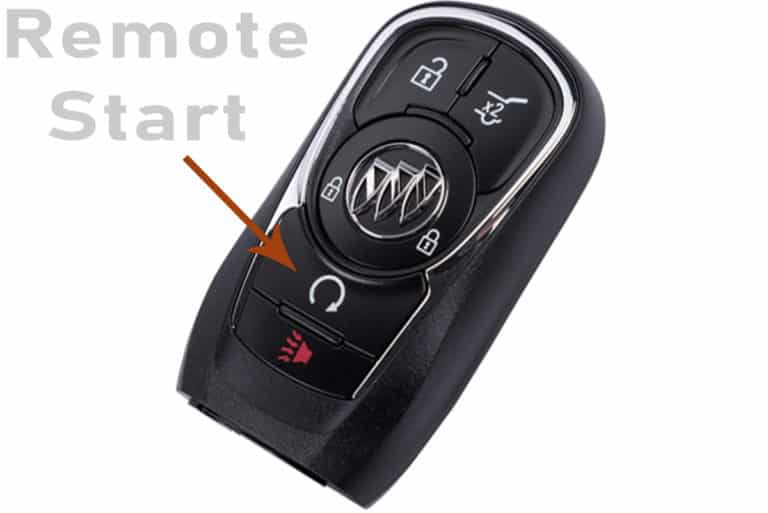
Locate an element on the screen. alarm button is located at coordinates (308, 362).